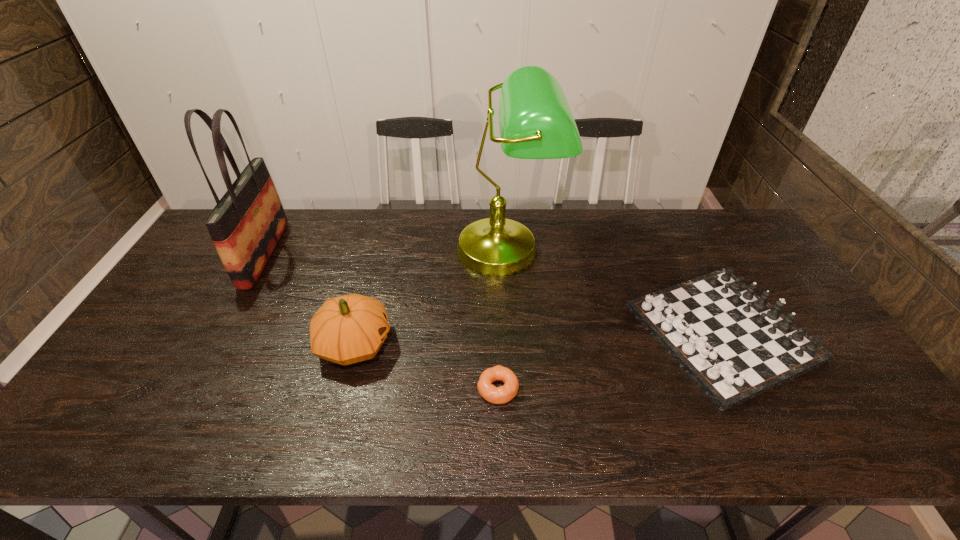
Find the location of a particular element. This screenshot has height=540, width=960. vacant point at the right edge is located at coordinates (748, 258).

At what (x,y) coordinates should I click in order to perform the action: click on blank space at the near left corner. Please return your answer as a coordinate pair (x, y). Looking at the image, I should click on (138, 413).

The width and height of the screenshot is (960, 540). Identify the location of free space at the far right corner of the desktop. (717, 212).

This screenshot has height=540, width=960. Identify the location of free point between the third shortest object and the lamp. (431, 296).

Image resolution: width=960 pixels, height=540 pixels. What are the coordinates of `free space between the lamp and the leftmost object` in the screenshot? It's located at (386, 252).

Where is `empty space between the rightmost object and the doughnut`? empty space between the rightmost object and the doughnut is located at coordinates (610, 361).

Locate an element on the screen. The width and height of the screenshot is (960, 540). vacant area between the leftmost object and the lamp is located at coordinates (386, 252).

Locate an element on the screen. This screenshot has height=540, width=960. vacant region between the lamp and the gourd is located at coordinates [431, 296].

The width and height of the screenshot is (960, 540). In order to click on free area in between the shortest object and the lamp in this screenshot , I will do `click(502, 319)`.

At what (x,y) coordinates should I click in order to perform the action: click on empty space that is in between the second object from left to right and the shortest object. Please return your answer as a coordinate pair (x, y). Looking at the image, I should click on (426, 366).